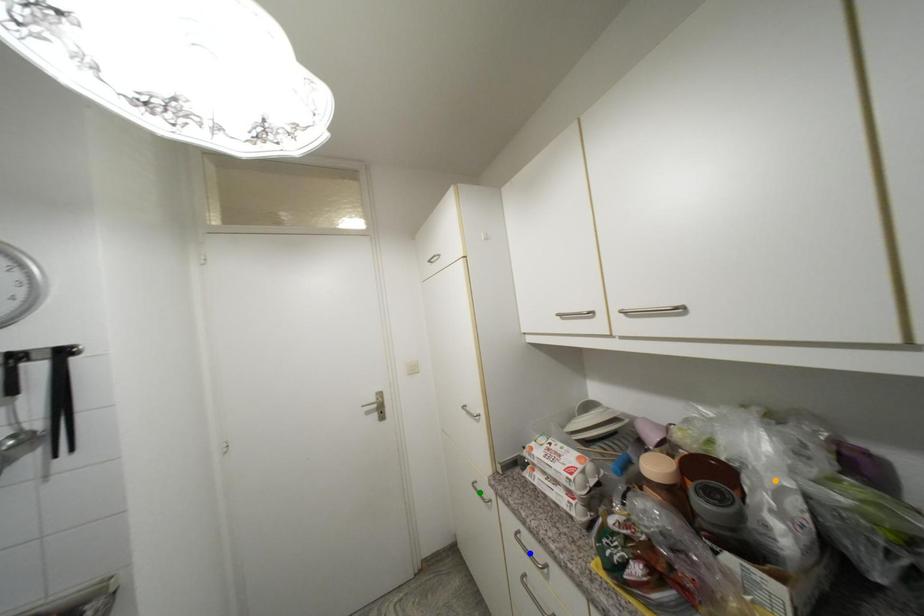
Order these from nearest to farthest:
green point | orange point | blue point

green point, blue point, orange point